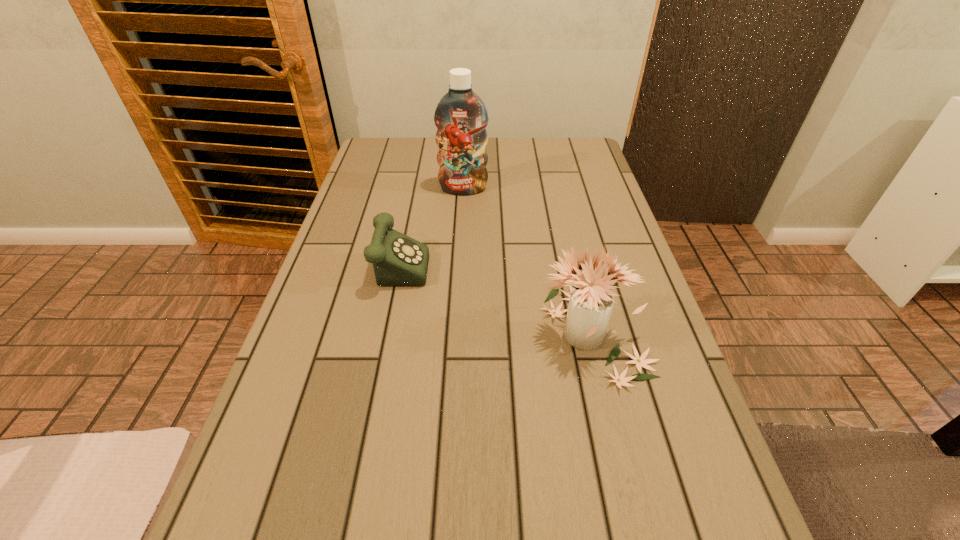
Identify the location of object that is positioned at the right edge. The height and width of the screenshot is (540, 960). point(591,301).

Find the location of `free space at the far edge`. free space at the far edge is located at coordinates (540, 137).

I want to click on free space at the left edge of the desktop, so click(340, 245).

At what (x,y) coordinates should I click in order to perform the action: click on vacant region at the right edge. Please return your answer as a coordinate pair (x, y). This screenshot has width=960, height=540. Looking at the image, I should click on (632, 253).

Find the location of a particular element. vacant area between the shortest object and the second object from left to right is located at coordinates (429, 224).

Where is `unoccupied area between the second tallest object and the farthest object`? The image size is (960, 540). unoccupied area between the second tallest object and the farthest object is located at coordinates (528, 261).

This screenshot has width=960, height=540. I want to click on free space between the bouquet and the telephone, so click(494, 297).

The width and height of the screenshot is (960, 540). I want to click on free space between the second shortest object and the telephone, so click(x=494, y=297).

Where is `empty space that is in between the second object from right to left and the bouquet`? This screenshot has width=960, height=540. empty space that is in between the second object from right to left and the bouquet is located at coordinates (528, 261).

Identify the location of blank region between the second object from right to left and the rightmost object. This screenshot has height=540, width=960. (528, 261).